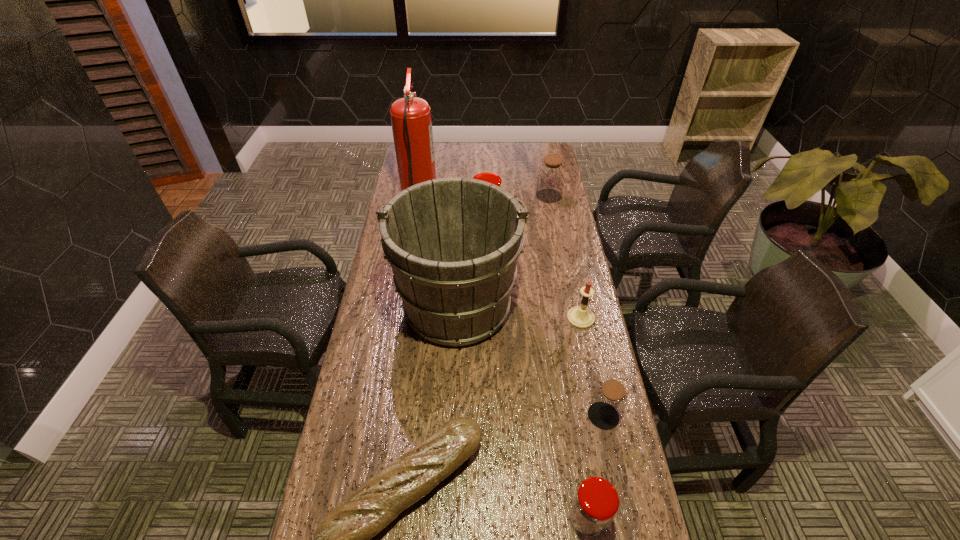
Where is `candle situated at the right edge`? The image size is (960, 540). candle situated at the right edge is located at coordinates (581, 317).

Identify the location of free space at the far edge. The height and width of the screenshot is (540, 960). coord(449,148).

Identify the location of vacant space at the right edge. Image resolution: width=960 pixels, height=540 pixels. (591, 299).

Locate an element on the screen. The width and height of the screenshot is (960, 540). vacant space at the far right corner of the desktop is located at coordinates (549, 145).

I want to click on vacant area that lies between the nearer brown jar and the third nearest jar, so click(x=545, y=316).

Find the location of a particular element. This screenshot has height=540, width=960. free spot between the farther brown jar and the candle is located at coordinates (564, 257).

Identify the location of free space between the bigger brown jar and the candle. (564, 257).

Where is `the fourth closest object to the farther red jar`? the fourth closest object to the farther red jar is located at coordinates (581, 317).

Locate which object is the closest to the baguet. Please provide its 2D coordinates. Your answer should be formatted as a tuple, i.e. [(x, y)], where the tuple contains the x and y coordinates of a point satisfying the conditions above.

[(595, 504)]

At what (x,y) coordinates should I click in order to perform the action: click on jar that is the fourth closest to the baguet. Please return your answer as a coordinate pair (x, y). This screenshot has height=540, width=960. Looking at the image, I should click on (551, 175).